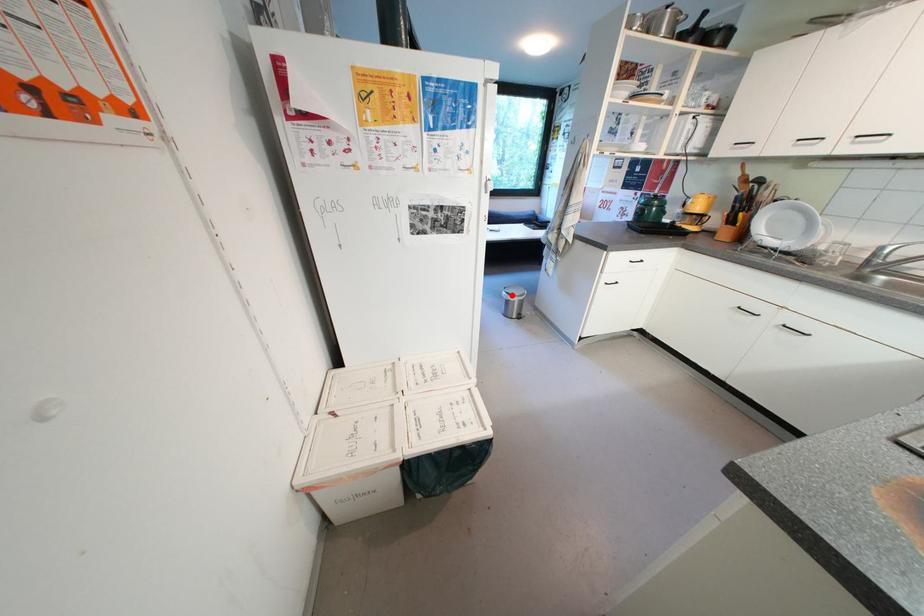
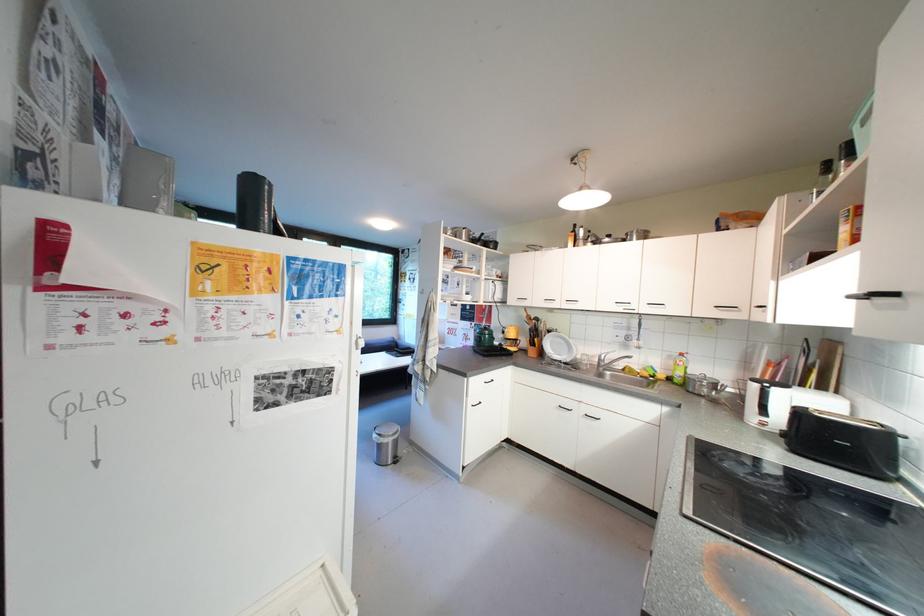
Locate, in the second image, the point that corresponds to the highlighted location in the first image.

(383, 438)